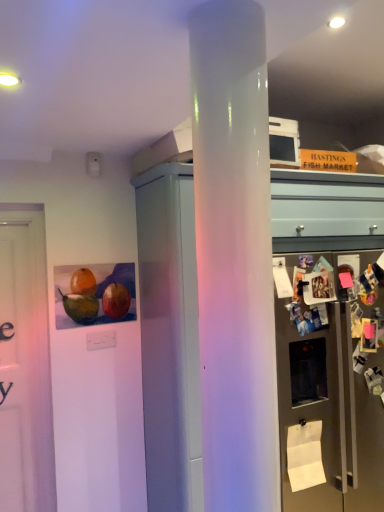
Question: Based on their sizes in the image, would you say white glossy cabinet at center is bigger or smaller than satin silver refrigerator at right?

Choices:
 (A) big
 (B) small

Answer: (A)

Question: Is point (148, 254) positioned closer to the camera than point (380, 413)?

Choices:
 (A) closer
 (B) farther

Answer: (A)

Question: Considering the real-world distances, which object is closest to the white paper at lower right?

Choices:
 (A) white glossy cabinet at center
 (B) satin silver refrigerator at right

Answer: (B)

Question: Which object is the farthest from the white paper at lower right?

Choices:
 (A) satin silver refrigerator at right
 (B) white glossy cabinet at center

Answer: (B)